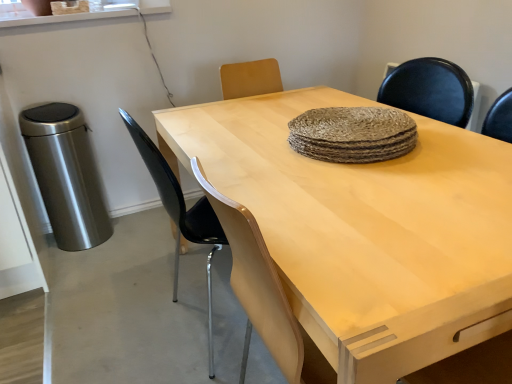
The image size is (512, 384). What do you see at coordinates (365, 231) in the screenshot? I see `light wood table at center` at bounding box center [365, 231].

This screenshot has width=512, height=384. Identify the location of light wood table at center. (365, 231).

What do you see at coordinates (181, 214) in the screenshot? I see `black plastic chair at center` at bounding box center [181, 214].

This screenshot has width=512, height=384. I want to click on black plastic chair at center, so click(181, 214).

The width and height of the screenshot is (512, 384). I want to click on light wood table at center, so click(365, 231).

Between black plastic chair at center and light wood table at center, which one appears on the right side from the viewer's perspective?

From the viewer's perspective, light wood table at center appears more on the right side.

Relative to light wood table at center, is black plastic chair at center in front or behind?

black plastic chair at center is behind light wood table at center.

Which is behind, point (160, 171) or point (395, 372)?

Point (160, 171)

From the image's perspective, is black plastic chair at center below light wood table at center?

Incorrect, from the image's perspective, black plastic chair at center is higher than light wood table at center.

In the scene shown: From a real-world perspective, between black plastic chair at center and light wood table at center, who is vertically lower?

In real-world perspective, light wood table at center is lower.

Considering the relative sizes of black plastic chair at center and light wood table at center in the image provided, is black plastic chair at center wider than light wood table at center?

In fact, black plastic chair at center might be narrower than light wood table at center.

Which of these two, black plastic chair at center or light wood table at center, stands taller?

black plastic chair at center is taller.

In terms of size, does black plastic chair at center appear bigger or smaller than light wood table at center?

Considering their sizes, black plastic chair at center takes up less space than light wood table at center.

Is light wood table at center completely or partially inside black plastic chair at center?

No, light wood table at center is not inside black plastic chair at center.

Is black plastic chair at center touching light wood table at center?

No, black plastic chair at center is not touching light wood table at center.

Is black plastic chair at center facing towards light wood table at center?

Yes.

Can you tell me how much black plastic chair at center and light wood table at center differ in facing direction?

black plastic chair at center and light wood table at center are facing 180 degrees away from each other.

Image resolution: width=512 pixels, height=384 pixels. Identify the location of chair lying behind the light wood table at center. (181, 214).

Is light wood table at center to the right of black plastic chair at center from the viewer's perspective?

Yes, light wood table at center is to the right of black plastic chair at center.

Is the depth of light wood table at center less than that of black plastic chair at center?

Yes, it is.

Which is behind, point (262, 120) or point (134, 125)?

The point (134, 125) is farther.

From the image's perspective, does light wood table at center appear lower than black plastic chair at center?

Yes, from the image's perspective, light wood table at center is below black plastic chair at center.

From a real-world perspective, does light wood table at center sit lower than black plastic chair at center?

Yes, from a real-world perspective, light wood table at center is under black plastic chair at center.

Considering the sizes of objects light wood table at center and black plastic chair at center in the image provided, who is wider, light wood table at center or black plastic chair at center?

With larger width is light wood table at center.

From their relative heights in the image, would you say light wood table at center is taller or shorter than black plastic chair at center?

Considering their sizes, light wood table at center has less height than black plastic chair at center.

Is light wood table at center bigger than black plastic chair at center?

Yes, light wood table at center is bigger than black plastic chair at center.

Can black plastic chair at center be found inside light wood table at center?

Yes, black plastic chair at center can be found within light wood table at center.

Is light wood table at center next to black plastic chair at center?

There is a gap between light wood table at center and black plastic chair at center.

Could you tell me if light wood table at center is turned towards black plastic chair at center?

Yes, light wood table at center is oriented towards black plastic chair at center.

What's the angular difference between light wood table at center and black plastic chair at center's facing directions?

light wood table at center and black plastic chair at center are facing 180 degrees away from each other.

How far apart are light wood table at center and black plastic chair at center?

light wood table at center and black plastic chair at center are 16.34 inches apart from each other.

This screenshot has width=512, height=384. I want to click on chair located on the left of light wood table at center, so click(x=181, y=214).

Locate an element on the screen. The width and height of the screenshot is (512, 384). table in front of the black plastic chair at center is located at coordinates pos(365,231).

Find the location of `table below the black plastic chair at center (from a real-world perspective)`. table below the black plastic chair at center (from a real-world perspective) is located at coordinates (365, 231).